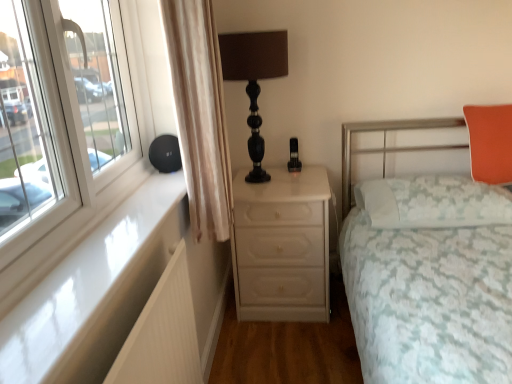
Question: Is orange fabric pillow at upper right, the second pillow from the bottom, in front of or behind white lace pillow at right, which is the second pillow in top-to-bottom order, in the image?

Choices:
 (A) front
 (B) behind

Answer: (B)

Question: Considering the positions of orange fabric pillow at upper right, the second pillow from the bottom, and white lace pillow at right, which is the second pillow in top-to-bottom order, in the image, is orange fabric pillow at upper right, the second pillow from the bottom, bigger or smaller than white lace pillow at right, which is the second pillow in top-to-bottom order,?

Choices:
 (A) small
 (B) big

Answer: (A)

Question: Which is nearer to the white glossy chest of drawers at center?

Choices:
 (A) white lace pillow at right, which is counted as the 1th pillow, starting from the bottom
 (B) black glossy table lamp at upper center
 (C) orange fabric pillow at upper right, acting as the first pillow starting from the top
 (D) white glossy window sill at left
 (E) white ribbed radiator at lower left

Answer: (A)

Question: Which is farther from the white floral fabric bed at right?

Choices:
 (A) white ribbed radiator at lower left
 (B) white glossy window sill at left
 (C) black glossy table lamp at upper center
 (D) white glossy chest of drawers at center
 (E) beige fabric curtain at left

Answer: (C)